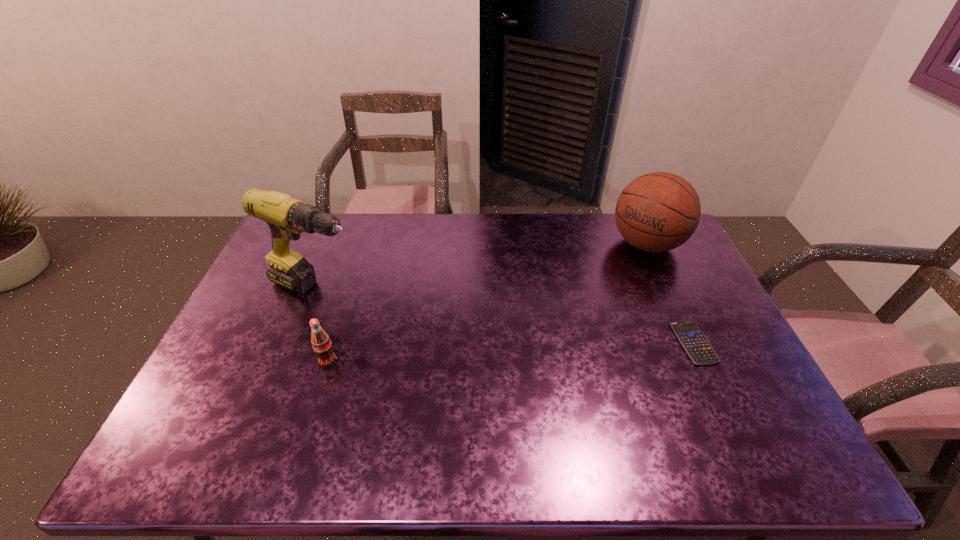
In the image, there is a desktop. Identify the location of blank space at the near edge. point(406,399).

This screenshot has width=960, height=540. In the image, there is a desktop. Identify the location of vacant space at the right edge. (674, 303).

This screenshot has width=960, height=540. In the image, there is a desktop. Identify the location of vacant space at the far left corner. (321, 242).

The width and height of the screenshot is (960, 540). I want to click on vacant space at the near left corner of the desktop, so click(221, 422).

At what (x,y) coordinates should I click in order to perform the action: click on vacant position at the near right corner of the desktop. Please return your answer as a coordinate pair (x, y). This screenshot has height=540, width=960. Looking at the image, I should click on click(x=767, y=419).

This screenshot has width=960, height=540. I want to click on vacant area between the shortest object and the tallest object, so pos(505,315).

Find the location of a particular element. This screenshot has height=540, width=960. blank region between the second tallest object and the third tallest object is located at coordinates (488, 303).

I want to click on empty space that is in between the calculator and the second farthest object, so click(505, 315).

This screenshot has height=540, width=960. I want to click on vacant space that is in between the farthest object and the tallest object, so click(482, 266).

Where is `free space between the farthest object and the shortest object`? free space between the farthest object and the shortest object is located at coordinates (670, 293).